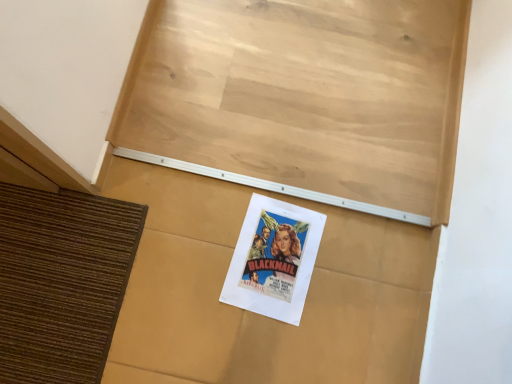
You are a GUI agent. You are given a task and a screenshot of the screen. Output one action in this format:
    pyautogui.click(x=<x>, y=<y>)
    Task: Click on the vacant point above matte paper poster at center (from a real-world perspective)
    The width and height of the screenshot is (512, 384).
    Given the screenshot: What is the action you would take?
    pyautogui.click(x=276, y=255)